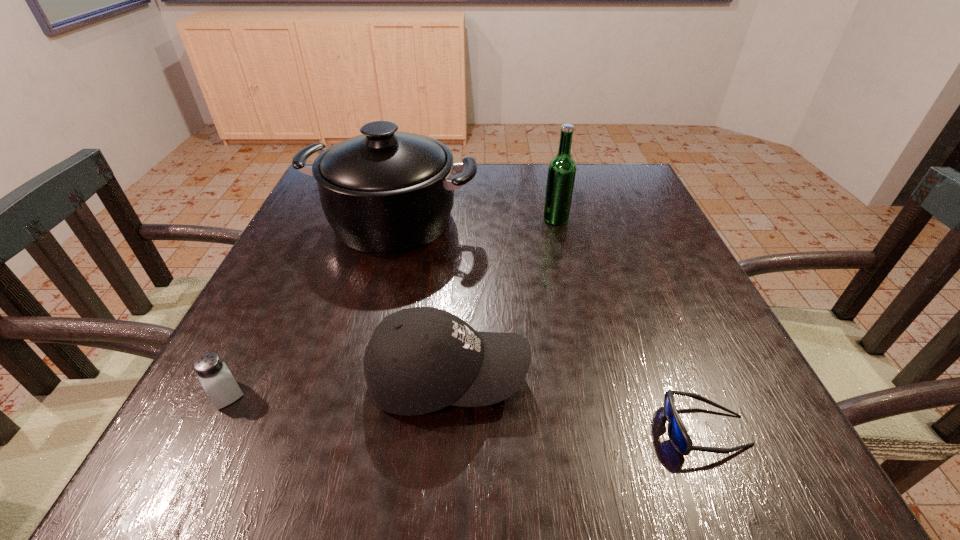
Where is `beer bottle`? The width and height of the screenshot is (960, 540). beer bottle is located at coordinates tap(561, 174).

You are a GUI agent. You are given a task and a screenshot of the screen. Output one action in this format:
    pyautogui.click(x=<x>, y=<y>)
    Task: Click on the saucepan
    
    Given the screenshot: What is the action you would take?
    pyautogui.click(x=384, y=192)

This screenshot has height=540, width=960. I want to click on baseball cap, so click(419, 360).

Identify the location of the fourth tallest object. (213, 374).

The image size is (960, 540). In order to click on sunglasses in this screenshot , I will do `click(677, 433)`.

Find the location of a particular element. This screenshot has height=540, width=960. the rightmost object is located at coordinates (677, 433).

Find the location of a particular element. free space located on the right of the fourth object from left to right is located at coordinates (593, 219).

You are a GUI agent. You are given a task and a screenshot of the screen. Output one action in this format:
    pyautogui.click(x=<x>, y=<y>)
    Task: Click on the free space located 0.170m on the right of the saucepan
    
    Given the screenshot: What is the action you would take?
    pyautogui.click(x=548, y=220)

Locate an element on the screen. The image size is (960, 540). vacant space located on the front-facing side of the third shortest object is located at coordinates 564,377.

At what (x,y) coordinates should I click in order to perform the action: click on vacant region located 0.200m on the back of the second shortest object. Please return your answer as a coordinate pair (x, y). The image size is (960, 540). Looking at the image, I should click on (276, 295).